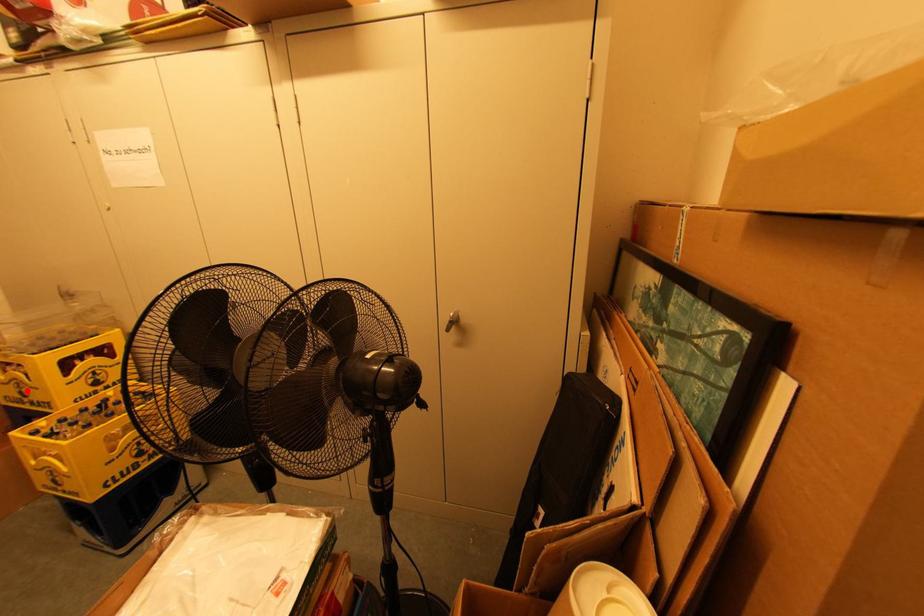
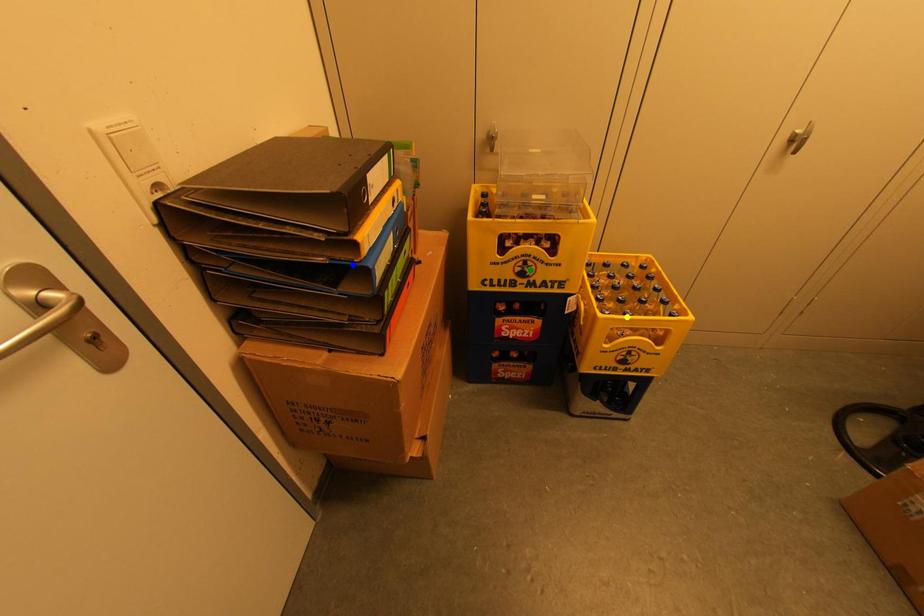
Question: I am providing you with two images of the same scene from different viewpoints. A red point is marked on the first image. You are given multiple points on the second image. Which spot in image 2 lines up with the point in image 1?

Choices:
 (A) yellow point
 (B) blue point
 (C) green point

Answer: (C)